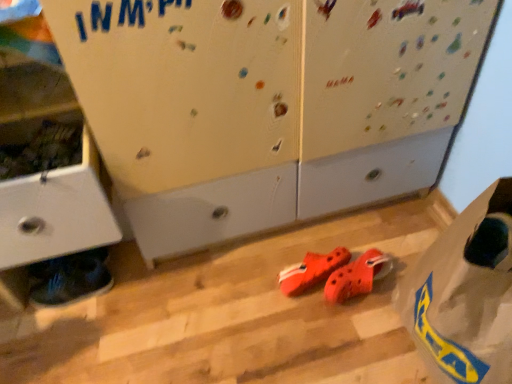
Locate an element on the screen. The image size is (512, 384). free space to the back side of rubber/crocodile-patterned shoes at center, placed as the 2th footwear when sorted from right to left is located at coordinates (307, 240).